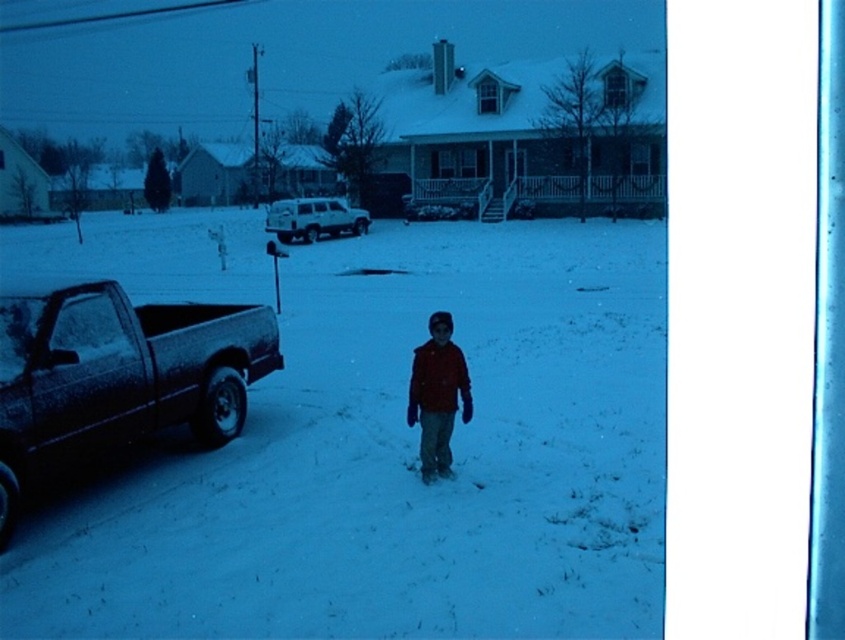
You are a photographer trying to capture a clear shot of the child in the red jacket. There is a pickup truck at point (116, 374). Is the truck positioned to the left or right of the child?

The truck at point (116, 374) is positioned to the left of the child in the red jacket.

You are standing at the camera position and want to walk to point (x=391, y=257). Is the distance more than 100 feet?

Yes, the distance between the camera and point (x=391, y=257) is 106.05 feet, which is more than 100 feet.